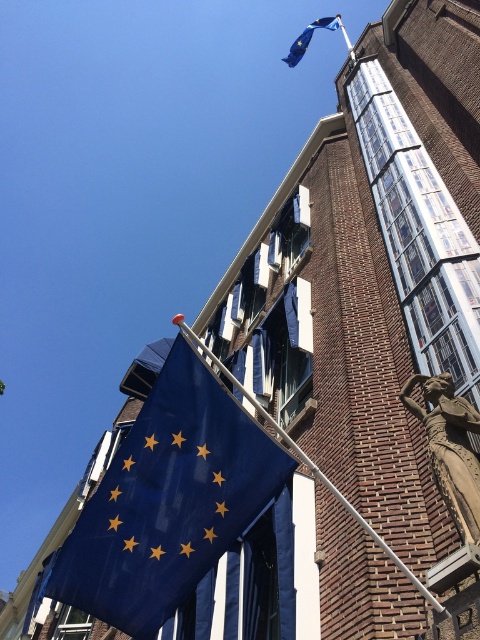
Question: Is blue matte flag at upper left below blue fabric flag at upper center?

Choices:
 (A) no
 (B) yes

Answer: (B)

Question: Among these objects, which one is nearest to the camera?

Choices:
 (A) blue matte flag at upper left
 (B) metallic silver pole at lower center
 (C) blue fabric flag at upper center

Answer: (B)

Question: Does blue matte flag at upper left have a larger size compared to blue fabric flag at upper center?

Choices:
 (A) yes
 (B) no

Answer: (B)

Question: Which point is farther to the camera?

Choices:
 (A) (73, 564)
 (B) (222, 364)

Answer: (B)

Question: Which of the following is the farthest from the observer?

Choices:
 (A) metallic silver pole at lower center
 (B) blue fabric flag at upper center

Answer: (B)

Question: Where is blue matte flag at upper left located in relation to blue fabric flag at upper center in the image?

Choices:
 (A) right
 (B) left

Answer: (B)